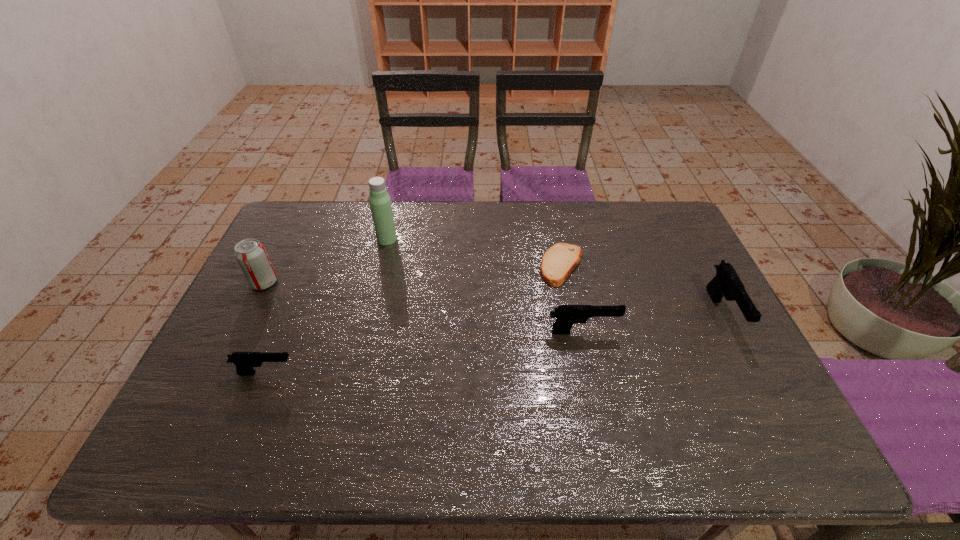
Where is `vacant space situated on the front-facing side of the second object from left to right`? vacant space situated on the front-facing side of the second object from left to right is located at coordinates (401, 373).

This screenshot has width=960, height=540. I want to click on free spot located 0.130m on the front-facing side of the second shortest pistol, so click(x=665, y=332).

The image size is (960, 540). In order to click on vacant space situated on the front-facing side of the tallest pistol in this screenshot , I will do `click(766, 397)`.

Locate an element on the screen. The height and width of the screenshot is (540, 960). free location located 0.390m on the front of the thermos bottle is located at coordinates (363, 340).

Identify the location of vacant space located 0.150m on the right of the shortest object. The image size is (960, 540). (633, 266).

Where is `free location located on the back of the soda can`? free location located on the back of the soda can is located at coordinates (285, 240).

Find the location of a particular element. The width and height of the screenshot is (960, 540). object positioned at the far edge is located at coordinates (380, 202).

I want to click on pistol located at the left edge, so click(245, 361).

You are a GUI agent. You are given a task and a screenshot of the screen. Output one action in this format:
    pyautogui.click(x=<x>, y=<y>)
    Task: Click on the soda can present at the left edge
    This screenshot has height=540, width=960.
    Given the screenshot: What is the action you would take?
    coord(250,254)

The height and width of the screenshot is (540, 960). I want to click on object at the right edge, so click(x=727, y=283).